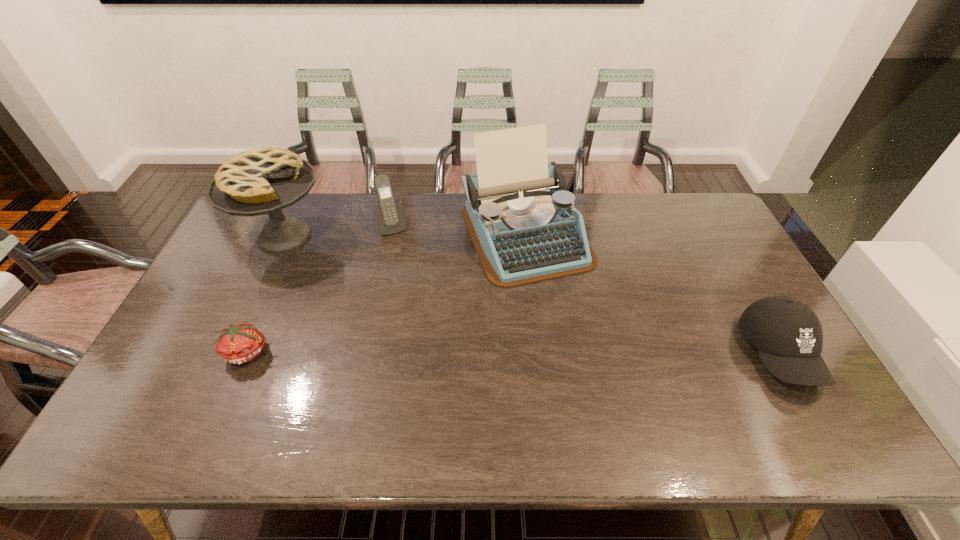
This screenshot has height=540, width=960. I want to click on free space between the fourth tallest object and the pie, so click(532, 295).

This screenshot has width=960, height=540. What are the coordinates of `object that is the third closest to the shortest object` in the screenshot? It's located at (524, 226).

Choose which object is the second nearest neighbor to the rightmost object. Please provide its 2D coordinates. Your answer should be formatted as a tuple, i.e. [(x, y)], where the tuple contains the x and y coordinates of a point satisfying the conditions above.

[(390, 215)]

Locate an element on the screen. vacant space that satisfies the following two spatial constraints: 1. on the back side of the pie; 2. on the left side of the third object from left to right is located at coordinates (289, 226).

Find the location of `free space in the image that satisfies the following two spatial constraints: 1. on the back side of the tomato; 2. on the right side of the typewriter`. free space in the image that satisfies the following two spatial constraints: 1. on the back side of the tomato; 2. on the right side of the typewriter is located at coordinates tap(298, 235).